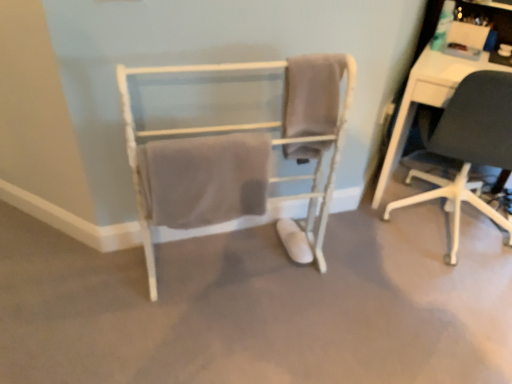
Where is `black matte chair at right, the 1th chair positioned from the right`? The width and height of the screenshot is (512, 384). black matte chair at right, the 1th chair positioned from the right is located at coordinates (468, 146).

This screenshot has width=512, height=384. What are the coordinates of `beige fabric towel at center, which ranks as the second bath towel in left-to-right order` in the screenshot? It's located at click(312, 94).

Where is `beige cotton towel at center, arranged as the 1th bath towel when viewed from the left`? Image resolution: width=512 pixels, height=384 pixels. beige cotton towel at center, arranged as the 1th bath towel when viewed from the left is located at coordinates (204, 179).

Locate an element on the screen. The width and height of the screenshot is (512, 384). white wood towel rack at center, which is counted as the 1th chair, starting from the left is located at coordinates (239, 155).

Find the location of `black matte chair at right, the 1th chair positioned from the right`. black matte chair at right, the 1th chair positioned from the right is located at coordinates (468, 146).

Are black matte chair at right, the 1th chair positioned from the right, and white wood towel rack at center, which is counted as the 1th chair, starting from the left, making contact?

No, black matte chair at right, the 1th chair positioned from the right, is not touching white wood towel rack at center, which is counted as the 1th chair, starting from the left.

How far apart are black matte chair at right, the 1th chair positioned from the right, and white wood towel rack at center, which ranks as the 2th chair in right-to-left order?

They are 29.67 inches apart.

In terms of height, does black matte chair at right, the 2th chair viewed from the left, look taller or shorter compared to white wood towel rack at center, which ranks as the 2th chair in right-to-left order?

Clearly, black matte chair at right, the 2th chair viewed from the left, is shorter compared to white wood towel rack at center, which ranks as the 2th chair in right-to-left order.

Does black matte chair at right, the 1th chair positioned from the right, have a smaller size compared to white wood towel rack at center, which ranks as the 2th chair in right-to-left order?

Incorrect, black matte chair at right, the 1th chair positioned from the right, is not smaller in size than white wood towel rack at center, which ranks as the 2th chair in right-to-left order.

Can you see beige fabric towel at center, which ranks as the second bath towel in left-to-right order, touching black matte chair at right, the 1th chair positioned from the right?

beige fabric towel at center, which ranks as the second bath towel in left-to-right order, and black matte chair at right, the 1th chair positioned from the right, are clearly separated.

From a real-world perspective, is beige fabric towel at center, which ranks as the second bath towel in left-to-right order, located higher than black matte chair at right, the 2th chair viewed from the left?

Yes.

From the image's perspective, is beige fabric towel at center, which is the first bath towel from right to left, located above black matte chair at right, the 2th chair viewed from the left?

Correct, beige fabric towel at center, which is the first bath towel from right to left, appears higher than black matte chair at right, the 2th chair viewed from the left, in the image.

Is beige fabric towel at center, which ranks as the second bath towel in left-to-right order, positioned in front of black matte chair at right, the 1th chair positioned from the right?

Yes.

From a real-world perspective, does beige fabric towel at center, which ranks as the second bath towel in left-to-right order, stand above white wood towel rack at center, which ranks as the 2th chair in right-to-left order?

Indeed, from a real-world perspective, beige fabric towel at center, which ranks as the second bath towel in left-to-right order, stands above white wood towel rack at center, which ranks as the 2th chair in right-to-left order.

Is beige fabric towel at center, which is the first bath towel from right to left, behind white wood towel rack at center, which is counted as the 1th chair, starting from the left?

Yes, beige fabric towel at center, which is the first bath towel from right to left, is behind white wood towel rack at center, which is counted as the 1th chair, starting from the left.

In order to click on bath towel on the right of the white wood towel rack at center, which is counted as the 1th chair, starting from the left in this screenshot , I will do `click(312, 94)`.

In the scene shown: From their relative heights in the image, would you say beige fabric towel at center, which is the first bath towel from right to left, is taller or shorter than white wood towel rack at center, which is counted as the 1th chair, starting from the left?

beige fabric towel at center, which is the first bath towel from right to left, is shorter than white wood towel rack at center, which is counted as the 1th chair, starting from the left.

Relative to beige fabric towel at center, which ranks as the second bath towel in left-to-right order, is white wood towel rack at center, which is counted as the 1th chair, starting from the left, in front or behind?

Visually, white wood towel rack at center, which is counted as the 1th chair, starting from the left, is located in front of beige fabric towel at center, which ranks as the second bath towel in left-to-right order.

From the image's perspective, who appears lower, white wood towel rack at center, which is counted as the 1th chair, starting from the left, or beige fabric towel at center, which ranks as the second bath towel in left-to-right order?

white wood towel rack at center, which is counted as the 1th chair, starting from the left.

Is white wood towel rack at center, which is counted as the 1th chair, starting from the left, oriented away from beige fabric towel at center, which ranks as the second bath towel in left-to-right order?

Absolutely, white wood towel rack at center, which is counted as the 1th chair, starting from the left, is directed away from beige fabric towel at center, which ranks as the second bath towel in left-to-right order.

Locate an element on the screen. The height and width of the screenshot is (384, 512). the 2nd chair below the beige fabric towel at center, which ranks as the second bath towel in left-to-right order (from the image's perspective) is located at coordinates pos(239,155).

From a real-world perspective, which object rests below the other?

black matte chair at right, the 1th chair positioned from the right, is physically lower.

Can you tell me how much black matte chair at right, the 2th chair viewed from the left, and beige fabric towel at center, which ranks as the second bath towel in left-to-right order, differ in facing direction?

The facing directions of black matte chair at right, the 2th chair viewed from the left, and beige fabric towel at center, which ranks as the second bath towel in left-to-right order, are 39.1 degrees apart.

Considering the relative positions of black matte chair at right, the 2th chair viewed from the left, and beige fabric towel at center, which ranks as the second bath towel in left-to-right order, in the image provided, is black matte chair at right, the 2th chair viewed from the left, to the right of beige fabric towel at center, which ranks as the second bath towel in left-to-right order, from the viewer's perspective?

Indeed, black matte chair at right, the 2th chair viewed from the left, is positioned on the right side of beige fabric towel at center, which ranks as the second bath towel in left-to-right order.

Is black matte chair at right, the 2th chair viewed from the left, at the left side of beige cotton towel at center, which appears as the 2th bath towel when viewed from the right?

No, black matte chair at right, the 2th chair viewed from the left, is not to the left of beige cotton towel at center, which appears as the 2th bath towel when viewed from the right.

Is black matte chair at right, the 1th chair positioned from the right, in front of or behind beige cotton towel at center, arranged as the 1th bath towel when viewed from the left, in the image?

In the image, black matte chair at right, the 1th chair positioned from the right, appears behind beige cotton towel at center, arranged as the 1th bath towel when viewed from the left.

From the image's perspective, is black matte chair at right, the 2th chair viewed from the left, above or below beige cotton towel at center, arranged as the 1th bath towel when viewed from the left?

Based on their image positions, black matte chair at right, the 2th chair viewed from the left, is located above beige cotton towel at center, arranged as the 1th bath towel when viewed from the left.

This screenshot has width=512, height=384. In order to click on bath towel below the black matte chair at right, the 1th chair positioned from the right (from the image's perspective) in this screenshot , I will do `click(204, 179)`.

Does beige cotton towel at center, arranged as the 1th bath towel when viewed from the left, have a greater height compared to white wood towel rack at center, which is counted as the 1th chair, starting from the left?

Incorrect, the height of beige cotton towel at center, arranged as the 1th bath towel when viewed from the left, is not larger of that of white wood towel rack at center, which is counted as the 1th chair, starting from the left.

Consider the image. Can you tell me how much beige cotton towel at center, arranged as the 1th bath towel when viewed from the left, and white wood towel rack at center, which is counted as the 1th chair, starting from the left, differ in facing direction?

They differ by 0.81 degrees in their facing directions.

From a real-world perspective, which is physically below, beige cotton towel at center, which appears as the 2th bath towel when viewed from the right, or white wood towel rack at center, which ranks as the 2th chair in right-to-left order?

white wood towel rack at center, which ranks as the 2th chair in right-to-left order, is physically lower.

Does beige cotton towel at center, arranged as the 1th bath towel when viewed from the left, turn towards white wood towel rack at center, which is counted as the 1th chair, starting from the left?

Yes, beige cotton towel at center, arranged as the 1th bath towel when viewed from the left, faces towards white wood towel rack at center, which is counted as the 1th chair, starting from the left.

Find the location of a particular element. The height and width of the screenshot is (384, 512). chair located on the right of white wood towel rack at center, which ranks as the 2th chair in right-to-left order is located at coordinates (468, 146).

The width and height of the screenshot is (512, 384). Find the location of `chair behind the beige fabric towel at center, which is the first bath towel from right to left`. chair behind the beige fabric towel at center, which is the first bath towel from right to left is located at coordinates (468, 146).

Based on their spatial positions, is beige fabric towel at center, which ranks as the second bath towel in left-to-right order, or white wood towel rack at center, which is counted as the 1th chair, starting from the left, closer to black matte chair at right, the 2th chair viewed from the left?

The object closer to black matte chair at right, the 2th chair viewed from the left, is beige fabric towel at center, which ranks as the second bath towel in left-to-right order.

Which object lies further to the anchor point white wood towel rack at center, which is counted as the 1th chair, starting from the left, beige fabric towel at center, which is the first bath towel from right to left, or black matte chair at right, the 1th chair positioned from the right?

black matte chair at right, the 1th chair positioned from the right, is positioned further to the anchor white wood towel rack at center, which is counted as the 1th chair, starting from the left.

From the image, which object appears to be nearer to black matte chair at right, the 2th chair viewed from the left, white wood towel rack at center, which is counted as the 1th chair, starting from the left, or beige cotton towel at center, which appears as the 2th bath towel when viewed from the right?

white wood towel rack at center, which is counted as the 1th chair, starting from the left.

Looking at the image, which one is located further to beige fabric towel at center, which ranks as the second bath towel in left-to-right order, beige cotton towel at center, which appears as the 2th bath towel when viewed from the right, or white wood towel rack at center, which is counted as the 1th chair, starting from the left?

beige cotton towel at center, which appears as the 2th bath towel when viewed from the right, is further to beige fabric towel at center, which ranks as the second bath towel in left-to-right order.

Considering their positions, is white wood towel rack at center, which is counted as the 1th chair, starting from the left, positioned further to beige fabric towel at center, which is the first bath towel from right to left, than beige cotton towel at center, arranged as the 1th bath towel when viewed from the left?

The object further to beige fabric towel at center, which is the first bath towel from right to left, is beige cotton towel at center, arranged as the 1th bath towel when viewed from the left.

Which object lies nearer to the anchor point black matte chair at right, the 2th chair viewed from the left, white wood towel rack at center, which is counted as the 1th chair, starting from the left, or beige fabric towel at center, which is the first bath towel from right to left?

beige fabric towel at center, which is the first bath towel from right to left, is closer to black matte chair at right, the 2th chair viewed from the left.

In the scene shown: Looking at the image, which one is located further to white wood towel rack at center, which is counted as the 1th chair, starting from the left, beige cotton towel at center, which appears as the 2th bath towel when viewed from the right, or beige fabric towel at center, which is the first bath towel from right to left?

beige fabric towel at center, which is the first bath towel from right to left, lies further to white wood towel rack at center, which is counted as the 1th chair, starting from the left, than the other object.

Estimate the real-world distances between objects in this image. Which object is further from beige cotton towel at center, arranged as the 1th bath towel when viewed from the left, black matte chair at right, the 2th chair viewed from the left, or white wood towel rack at center, which ranks as the 2th chair in right-to-left order?

black matte chair at right, the 2th chair viewed from the left, is further to beige cotton towel at center, arranged as the 1th bath towel when viewed from the left.

I want to click on chair between beige cotton towel at center, which appears as the 2th bath towel when viewed from the right, and black matte chair at right, the 2th chair viewed from the left, from left to right, so click(x=239, y=155).

The width and height of the screenshot is (512, 384). In order to click on bath towel between beige cotton towel at center, arranged as the 1th bath towel when viewed from the left, and black matte chair at right, the 2th chair viewed from the left, from left to right in this screenshot , I will do `click(312, 94)`.

At what (x,y) coordinates should I click in order to perform the action: click on chair between beige cotton towel at center, arranged as the 1th bath towel when viewed from the left, and beige fabric towel at center, which is the first bath towel from right to left, from left to right. Please return your answer as a coordinate pair (x, y). Looking at the image, I should click on (239, 155).

Find the location of a particular element. bath towel between white wood towel rack at center, which is counted as the 1th chair, starting from the left, and black matte chair at right, the 1th chair positioned from the right, in the horizontal direction is located at coordinates click(x=312, y=94).